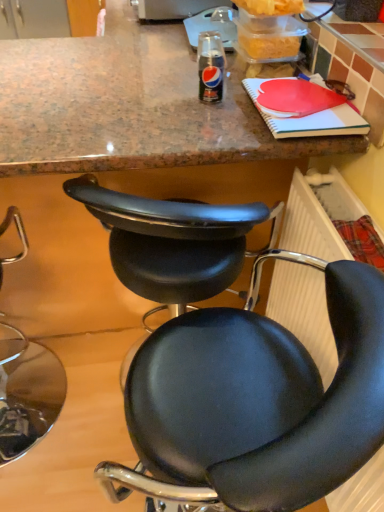
Question: Is black leather chair at center, which appears as the second chair when viewed from the left, thinner than plastic radiator at lower right?

Choices:
 (A) no
 (B) yes

Answer: (A)

Question: Can you confirm if black leather chair at center, which ranks as the second chair in right-to-left order, is shorter than plastic radiator at lower right?

Choices:
 (A) yes
 (B) no

Answer: (B)

Question: Can you confirm if black leather chair at center, which ranks as the second chair in right-to-left order, is positioned to the left of plastic radiator at lower right?

Choices:
 (A) yes
 (B) no

Answer: (A)

Question: Considering the relative positions of black leather chair at center, which ranks as the second chair in right-to-left order, and plastic radiator at lower right in the image provided, is black leather chair at center, which ranks as the second chair in right-to-left order, to the right of plastic radiator at lower right from the viewer's perspective?

Choices:
 (A) yes
 (B) no

Answer: (B)

Question: From a real-world perspective, is black leather chair at center, which appears as the second chair when viewed from the left, on plastic radiator at lower right?

Choices:
 (A) no
 (B) yes

Answer: (A)

Question: From a real-world perspective, is black leather chair at center, which appears as the second chair when viewed from the left, positioned under plastic radiator at lower right based on gravity?

Choices:
 (A) no
 (B) yes

Answer: (B)

Question: Is black leather chair at lower left, acting as the 1th chair starting from the left, positioned before black leather chair at center, which ranks as the second chair in right-to-left order?

Choices:
 (A) yes
 (B) no

Answer: (A)

Question: Is black leather chair at lower left, acting as the 1th chair starting from the left, to the left of black leather chair at center, which ranks as the second chair in right-to-left order, from the viewer's perspective?

Choices:
 (A) no
 (B) yes

Answer: (B)

Question: Is black leather chair at lower left, arranged as the third chair when viewed from the right, at the right side of black leather chair at center, which ranks as the second chair in right-to-left order?

Choices:
 (A) yes
 (B) no

Answer: (B)

Question: Is black leather chair at lower left, acting as the 1th chair starting from the left, further to the viewer compared to black leather chair at center, which appears as the second chair when viewed from the left?

Choices:
 (A) yes
 (B) no

Answer: (B)

Question: Is black leather chair at lower left, acting as the 1th chair starting from the left, directly adjacent to black leather chair at center, which ranks as the second chair in right-to-left order?

Choices:
 (A) yes
 (B) no

Answer: (B)

Question: Considering the relative sizes of black leather chair at lower left, arranged as the third chair when viewed from the right, and black leather chair at center, which appears as the second chair when viewed from the left, in the image provided, is black leather chair at lower left, arranged as the third chair when viewed from the right, thinner than black leather chair at center, which appears as the second chair when viewed from the left,?

Choices:
 (A) yes
 (B) no

Answer: (B)

Question: From the image's perspective, is black leather chair at center, the first chair in the right-to-left sequence, on top of black leather chair at center, which ranks as the second chair in right-to-left order?

Choices:
 (A) no
 (B) yes

Answer: (A)